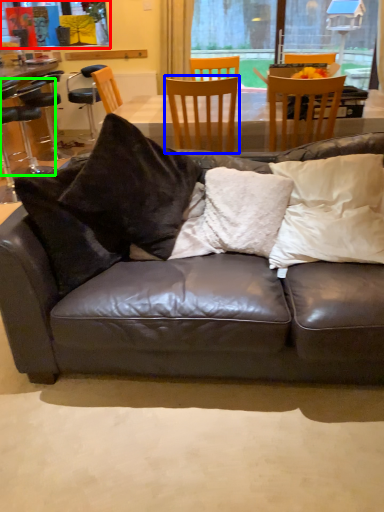
Question: Which is farther away from window screen (highlighted by a red box)? chair (highlighted by a blue box) or chair (highlighted by a green box)?

Choices:
 (A) chair
 (B) chair

Answer: (A)